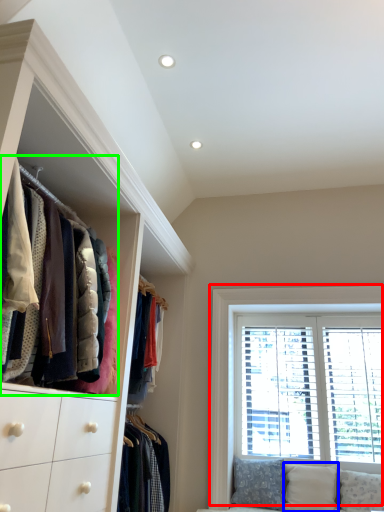
Question: Considering the real-world distances, which object is farthest from window (highlighted by a red box)? pillow (highlighted by a blue box) or closet (highlighted by a green box)?

Choices:
 (A) pillow
 (B) closet

Answer: (B)